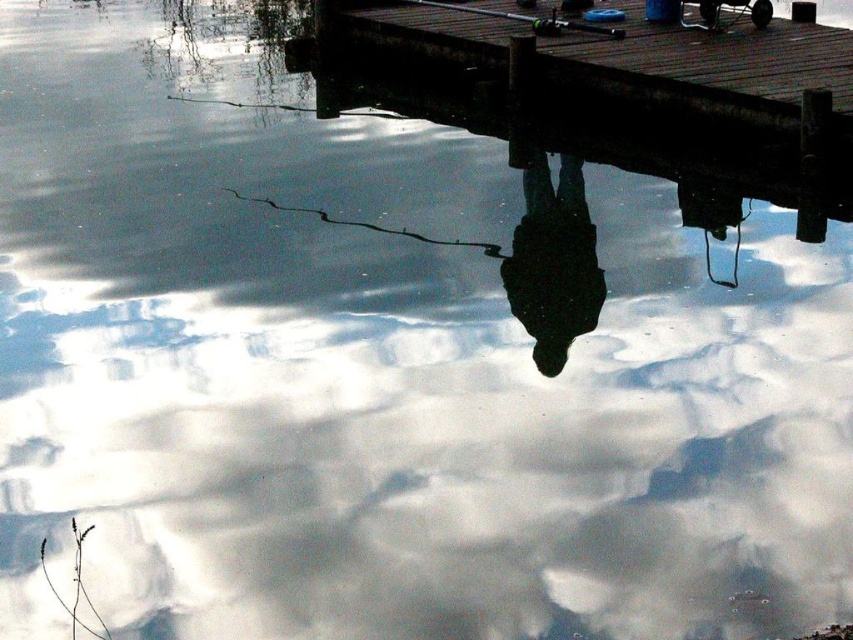
You are a photographer trying to capture the reflection of the wooden dock at upper center in the water. Based on the scene, where should you position your camera to ensure the reflection is fully visible in the photo?

To capture the full reflection of the wooden dock at upper center, position the camera directly above the water surface at the point corresponding to its 2D location at coordinates (x=614, y=61). This ensures the reflection aligns perfectly with the actual dock.

You are standing on the dock and want to move from the point at coordinates point (410, 28) to the point at coordinates point (538, 22). Which direction should you walk to get closer to your destination?

To move from point (410, 28) to point (538, 22), you should walk forward because point (410, 28) is behind point (538, 22), meaning your destination is in front of you.

You are standing at the point marked by coordinates point (614, 61) in the image. What object are you currently standing on?

The point (614, 61) marks the wooden dock at upper center, so you are standing on the wooden dock at upper center.